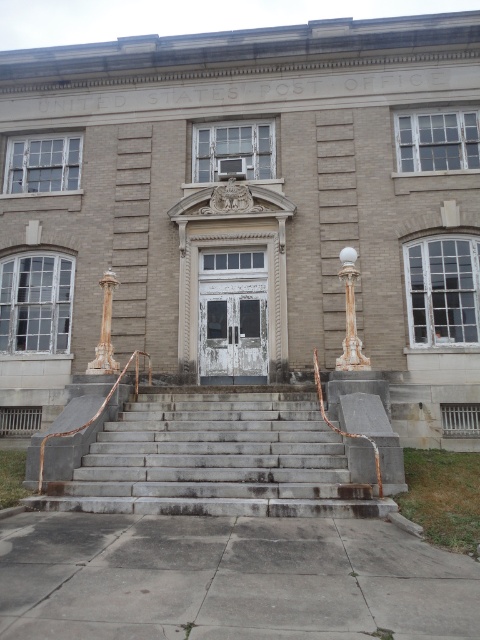
Does point (370, 488) come in front of point (103, 308)?

Yes.

Does gray concrete stairs at center lie behind marble column at left?

No, it is not.

Who is more forward, (383, 461) or (109, 353)?

Point (383, 461) is more forward.

Locate an element on the screen. The image size is (480, 640). gray concrete stairs at center is located at coordinates (222, 458).

Consider the image. Is white marble column at center positioned behind marble column at left?

No, white marble column at center is closer to the viewer.

Is point (346, 356) farther from camera compared to point (90, 364)?

No, (346, 356) is closer to viewer.

I want to click on white marble column at center, so click(350, 317).

What do you see at coordinates (222, 458) in the screenshot? I see `gray concrete stairs at center` at bounding box center [222, 458].

Does gray concrete stairs at center have a lesser width compared to white marble column at center?

No, gray concrete stairs at center is not thinner than white marble column at center.

Between point (333, 481) and point (350, 246), which one is positioned behind?

Positioned behind is point (350, 246).

Where is `gray concrete stairs at center`? This screenshot has width=480, height=640. gray concrete stairs at center is located at coordinates (222, 458).